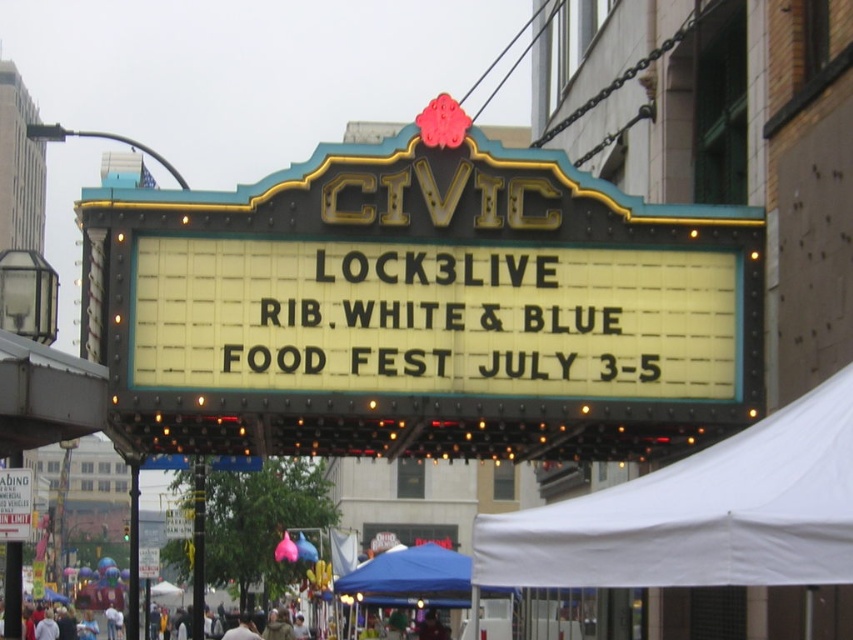
Question: Which object is farther from the camera taking this photo?

Choices:
 (A) white fabric canopy at lower right
 (B) white paper sign at upper center
 (C) white matte crowd at lower center

Answer: (C)

Question: Which object appears farthest from the camera in this image?

Choices:
 (A) gold metallic marquee at center
 (B) white paper sign at upper center
 (C) white matte crowd at lower center

Answer: (C)

Question: Is blue fabric canopy at lower center further to camera compared to white paper sign at upper center?

Choices:
 (A) yes
 (B) no

Answer: (B)

Question: Can you confirm if gold metallic marquee at center is smaller than white paper sign at upper center?

Choices:
 (A) no
 (B) yes

Answer: (A)

Question: Can you confirm if white fabric canopy at lower right is positioned below white paper sign at upper center?

Choices:
 (A) no
 (B) yes

Answer: (A)

Question: Which object is positioned farthest from the white matte crowd at lower center?

Choices:
 (A) white fabric canopy at lower right
 (B) white paper sign at upper center
 (C) gold metallic marquee at center
 (D) blue fabric canopy at lower center

Answer: (A)